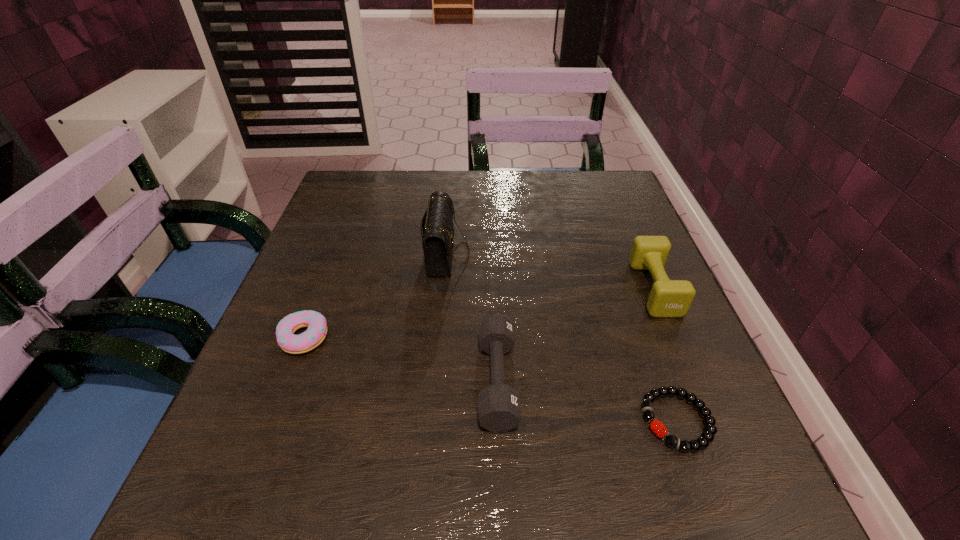
Where is `vacant region located 0.080m on the left of the nearer dumbbell`? The image size is (960, 540). vacant region located 0.080m on the left of the nearer dumbbell is located at coordinates (431, 380).

Image resolution: width=960 pixels, height=540 pixels. I want to click on vacant space located 0.050m on the back of the fourth tallest object, so click(318, 300).

You are a GUI agent. You are given a task and a screenshot of the screen. Output one action in this format:
    pyautogui.click(x=<x>, y=<y>)
    Task: Click on the vacant area located on the back of the bracelet
    The height and width of the screenshot is (540, 960).
    Given the screenshot: What is the action you would take?
    pyautogui.click(x=614, y=248)

This screenshot has height=540, width=960. What are the coordinates of `object at the left edge` in the screenshot? It's located at (316, 332).

Where is `dumbbell present at the right edge`? dumbbell present at the right edge is located at coordinates (668, 298).

I want to click on bracelet that is at the right edge, so click(707, 436).

Image resolution: width=960 pixels, height=540 pixels. In the image, there is a desktop. What are the coordinates of `vacant region at the far edge` in the screenshot? It's located at (397, 188).

In the image, there is a desktop. Where is `vacant space at the near edge`? This screenshot has height=540, width=960. vacant space at the near edge is located at coordinates (410, 487).

In the image, there is a desktop. Identify the location of free region at the left edge. This screenshot has width=960, height=540. (252, 429).

Find the location of a particular element. The height and width of the screenshot is (540, 960). vacant space at the right edge of the desktop is located at coordinates (663, 443).